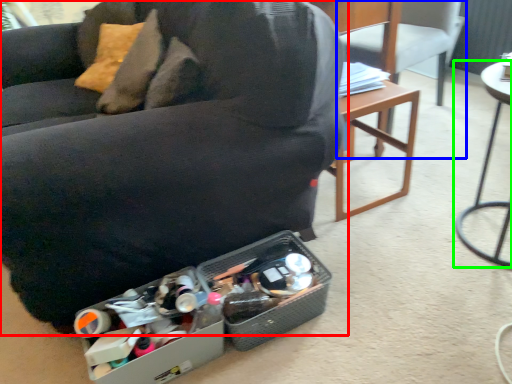
Question: Estimate the real-world distances between objects in this image. Which object is closer to chair (highlighted by a red box), chair (highlighted by a blue box) or table (highlighted by a green box)?

Choices:
 (A) chair
 (B) table

Answer: (B)